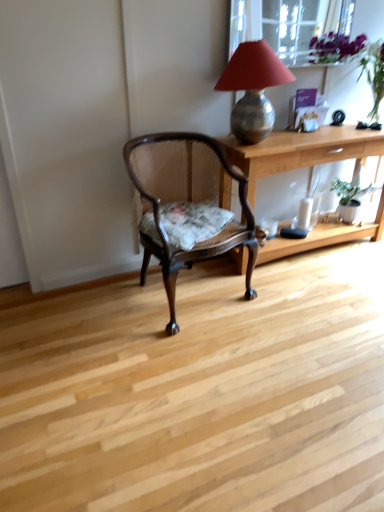
The image size is (384, 512). I want to click on free space to the right of mahogany cane chair at center, so click(286, 305).